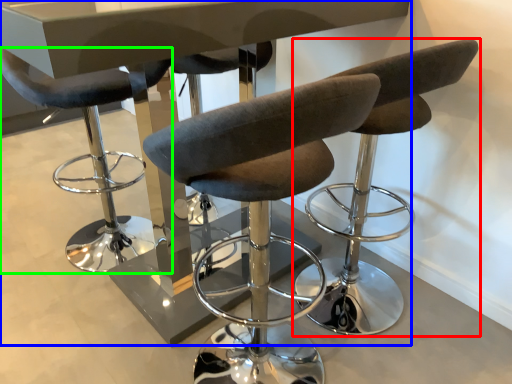
Question: Which object is positioned farthest from chair (highlighted by a red box)? Select from table (highlighted by a blue box) and chair (highlighted by a green box).

Choices:
 (A) table
 (B) chair

Answer: (B)